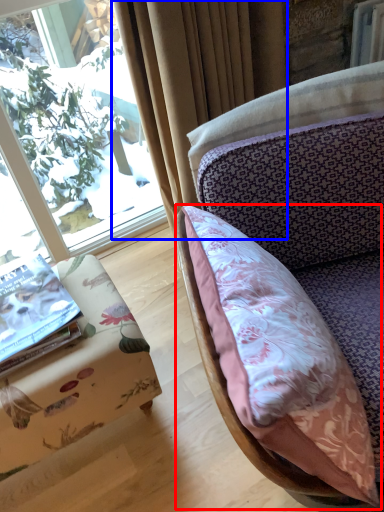
Question: Which object is further to the camera taking this photo, pillow (highlighted by a red box) or curtain (highlighted by a blue box)?

Choices:
 (A) pillow
 (B) curtain

Answer: (B)